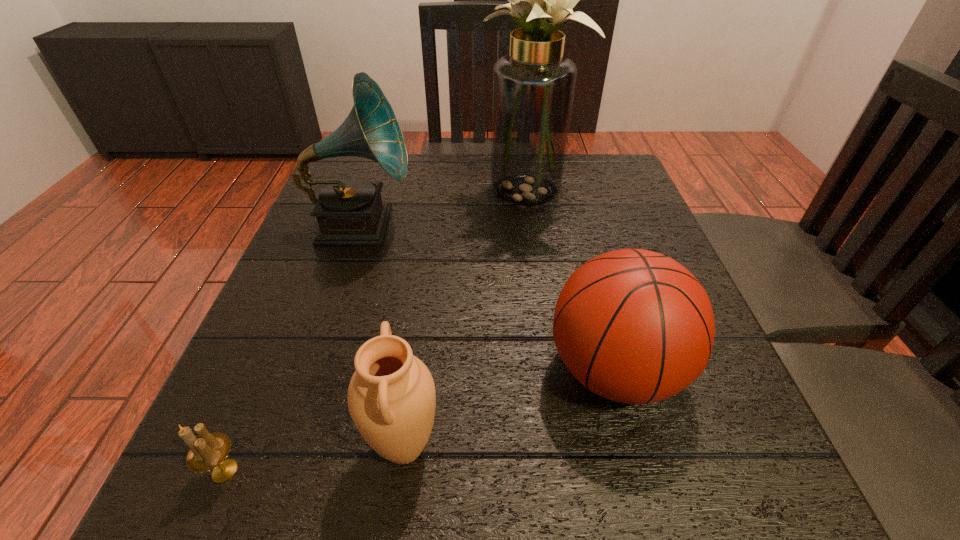
I want to click on the tallest object, so click(x=533, y=88).

Find the location of a particular element. The image size is (960, 540). the fourth shortest object is located at coordinates (350, 211).

This screenshot has width=960, height=540. What are the coordinates of `basketball` in the screenshot? It's located at (634, 326).

You are a GUI agent. You are given a task and a screenshot of the screen. Output one action in this format:
    pyautogui.click(x=<x>, y=<y>)
    Task: Click on the urn
    This screenshot has width=960, height=540.
    Given the screenshot: What is the action you would take?
    pyautogui.click(x=391, y=397)

Where is `the shortest object`? This screenshot has height=540, width=960. the shortest object is located at coordinates (209, 451).

Locate an element on the screen. The width and height of the screenshot is (960, 540). free space located 0.220m on the front of the tallest object is located at coordinates (543, 291).

At what (x,y) coordinates should I click in order to perform the action: click on vacant space situated from the horn of the fourth shortest object. Please return your answer as a coordinate pair (x, y). The height and width of the screenshot is (540, 960). Looking at the image, I should click on (468, 225).

Find the location of `blank space located 0.200m on the left of the basketball`. blank space located 0.200m on the left of the basketball is located at coordinates (419, 370).

The image size is (960, 540). I want to click on free space located 0.190m on the right of the urn, so click(x=581, y=447).

The height and width of the screenshot is (540, 960). In order to click on free space located on the back of the candle holder in this screenshot , I will do `click(257, 394)`.